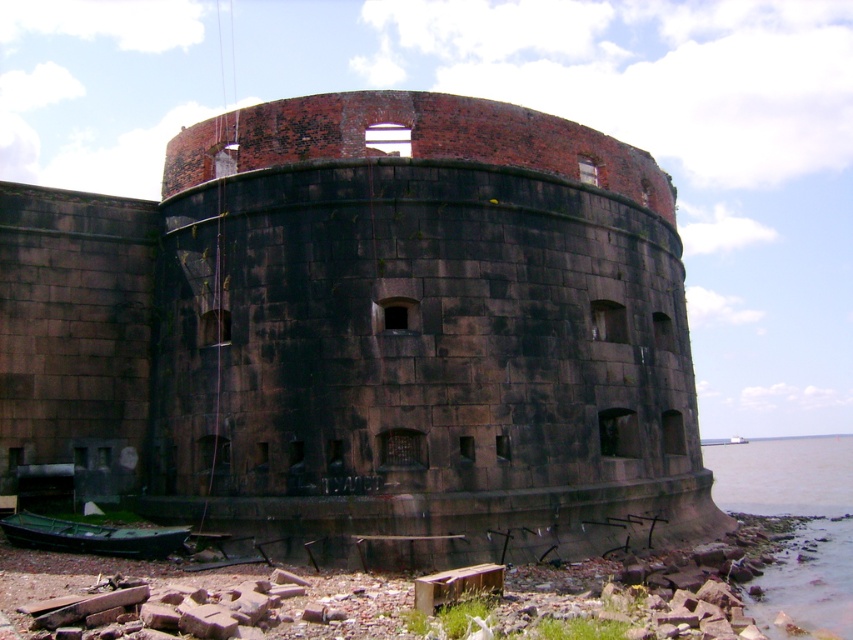
You are an engineer assessing the stability of the dark brick castle at center and the brown water at lower right. Based on their sizes, which one might be more vulnerable to strong winds?

The brown water at lower right is shorter than the dark brick castle at center, so it might be more vulnerable to strong winds because it has a lower height and less structural mass to resist wind forces.

You are an architect assessing the structural integrity of the dark brick castle at center and the brown water at lower right. Which object occupies a smaller horizontal space in the image?

The dark brick castle at center has a lesser width compared to the brown water at lower right, so the dark brick castle at center occupies a smaller horizontal space in the image.

You are standing at the base of the fort and want to walk to the boat. There are two points marked on the ground. The first point is at coordinates point (762, 579) and the second point is at point (155, 532). Which point should you head towards to reach the boat without going through the rubble pile?

You should head towards point (155, 532) because point (762, 579) is behind it, meaning the boat is likely closer to the second point and avoids the rubble pile.